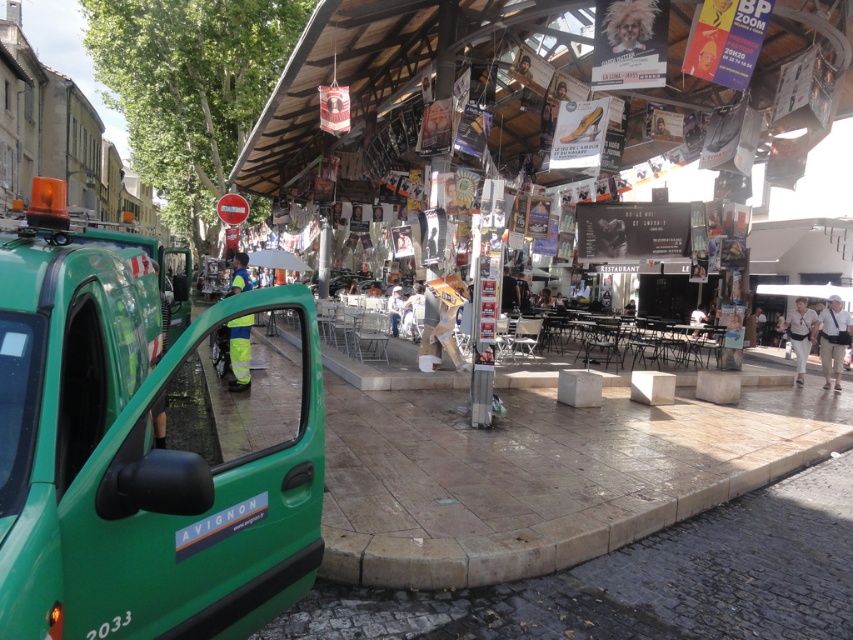
Between point (796, 298) and point (402, 301), which one is positioned in front?

Point (402, 301) is more forward.

Can you confirm if white fabric bag at lower right is positioned below white fabric shirt at center?

Indeed, white fabric bag at lower right is positioned under white fabric shirt at center.

The width and height of the screenshot is (853, 640). Describe the element at coordinates (799, 333) in the screenshot. I see `white fabric bag at lower right` at that location.

This screenshot has height=640, width=853. In order to click on white fabric bag at lower right in this screenshot , I will do `click(799, 333)`.

Can you confirm if green matte taxi at left is positioned above light beige cotton pants at lower right?

Incorrect, green matte taxi at left is not positioned above light beige cotton pants at lower right.

Does green matte taxi at left appear under light beige cotton pants at lower right?

Yes.

What do you see at coordinates (144, 451) in the screenshot?
I see `green matte taxi at left` at bounding box center [144, 451].

Where is `green matte taxi at left`? The image size is (853, 640). green matte taxi at left is located at coordinates (144, 451).

I want to click on curly blonde hair at upper center, so click(x=630, y=22).

Is curly blonde hair at upper center further to camera compared to white fabric bag at lower right?

No.

The width and height of the screenshot is (853, 640). I want to click on curly blonde hair at upper center, so click(x=630, y=22).